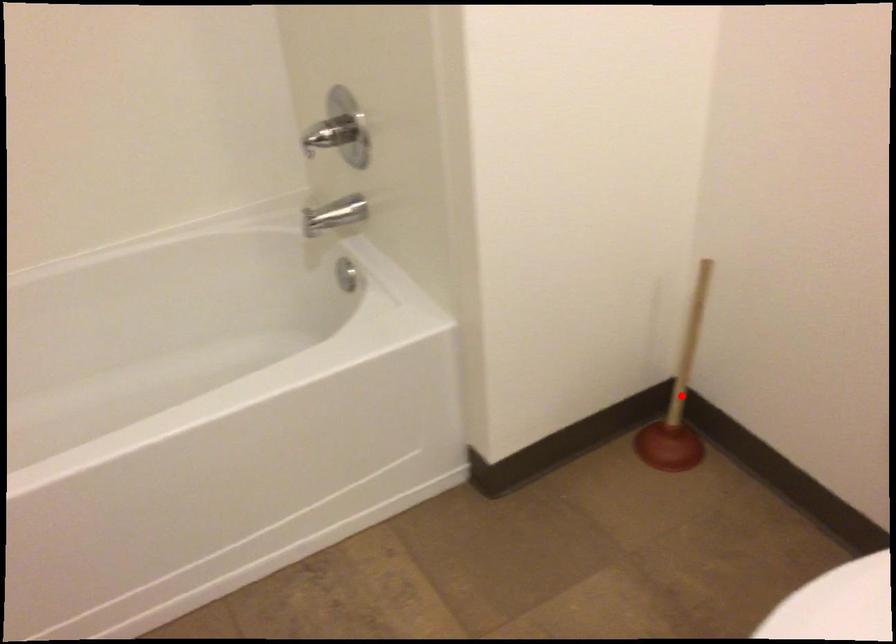
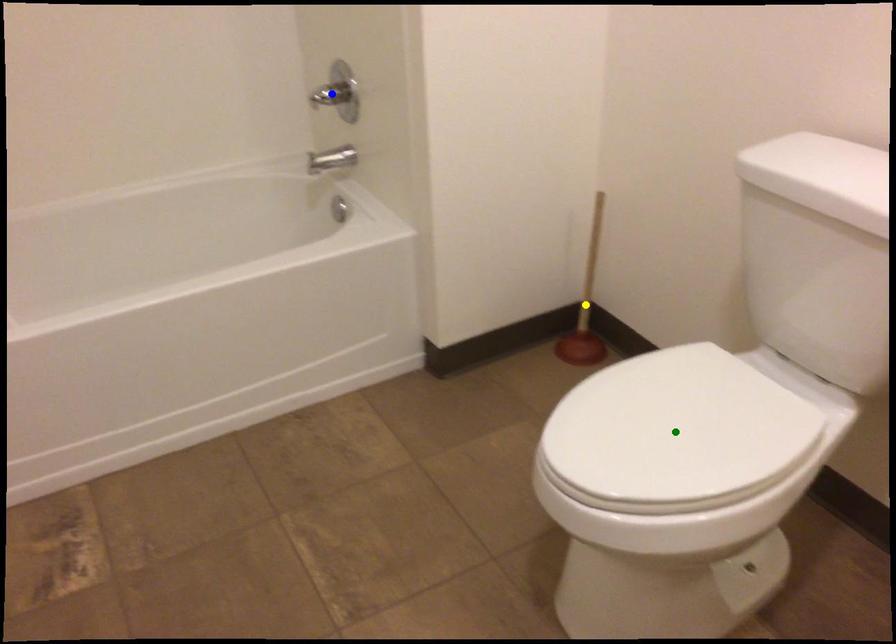
Question: I am providing you with two images of the same scene from different viewpoints. A red point is marked on the first image. You are given multiple points on the second image. Can you choose the point in image 2 that corresponds to the point in image 1?

Choices:
 (A) blue point
 (B) green point
 (C) yellow point

Answer: (C)